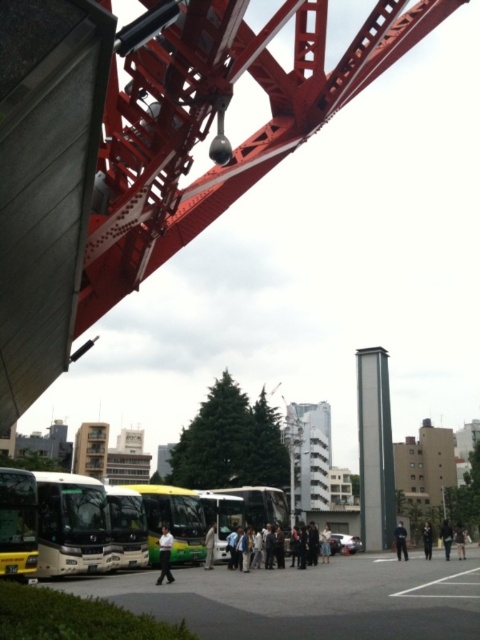
Question: Can you confirm if dark blue uniform at center is positioned to the right of black fabric person at lower center?

Choices:
 (A) yes
 (B) no

Answer: (B)

Question: Considering the relative positions of green matte bus at center and black fabric person at lower center in the image provided, where is green matte bus at center located with respect to black fabric person at lower center?

Choices:
 (A) below
 (B) above

Answer: (B)

Question: Which point is farther to the camera?

Choices:
 (A) dark brown leather jacket at center
 (B) dark blue uniform at center
 (C) white cotton shirt at center

Answer: (A)

Question: Which point is farther to the camera?

Choices:
 (A) (328, 536)
 (B) (51, 500)
 (C) (446, 538)
 (D) (170, 582)

Answer: (A)

Question: Does white matte shirt at center appear over dark brown leather jacket at center?

Choices:
 (A) yes
 (B) no

Answer: (A)

Question: Among these points, which one is farthest from the camera?

Choices:
 (A) (197, 509)
 (B) (212, 554)
 (C) (402, 540)
 (D) (233, 528)

Answer: (C)